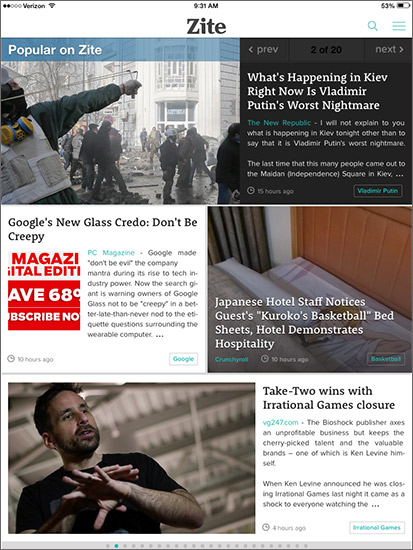
The height and width of the screenshot is (550, 413). Find the location of `drapes`. drapes is located at coordinates (243, 230).